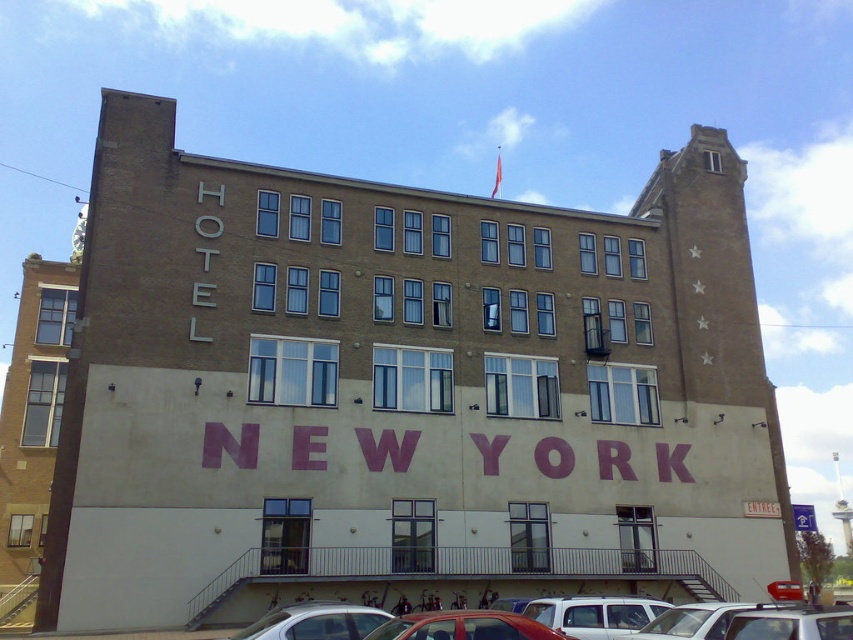
You are standing at the location of the camera and want to take a photo of the white matte van at center. The camera has a maximum range of 80 feet. Will you be able to capture the van clearly?

The white matte van at center and camera are 83.60 feet apart from each other, which exceeds the camera maximum range of 80 feet. Therefore, you will not be able to capture the van clearly.

You are a photographer standing in front of the beige brick building at left and the shiny red car at center. You want to take a photo that includes both objects in the frame. Which object should you position closer to the edge of the frame to ensure both are fully visible?

Since the beige brick building at left is taller than the shiny red car at center, you should position the beige brick building at left closer to the edge of the frame to ensure both are fully visible.

You are standing in front of the HOTEL NEW YORK building. You notice two points marked on the right side of the building. One is at coordinate point (820, 628) and the other at point (682, 624). From your perspective, which point is closer to you?

Point (820, 628) is in front of point (682, 624), so it is closer to you.